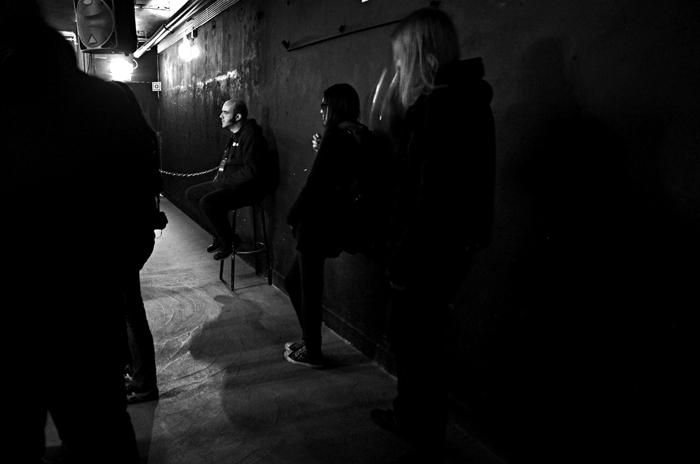
Where is `light bulb`? The image size is (700, 464). light bulb is located at coordinates (186, 48).